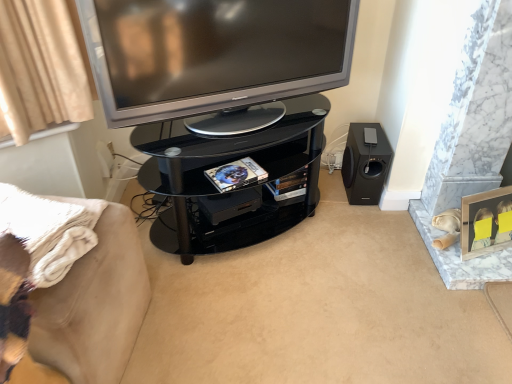
You are a GUI agent. You are given a task and a screenshot of the screen. Output one action in this format:
    pyautogui.click(x=<x>, y=<y>)
    Task: Click on the free space between black matte speaker at lower right and black glass tv cabinet at center
    
    Given the screenshot: What is the action you would take?
    pyautogui.click(x=337, y=190)